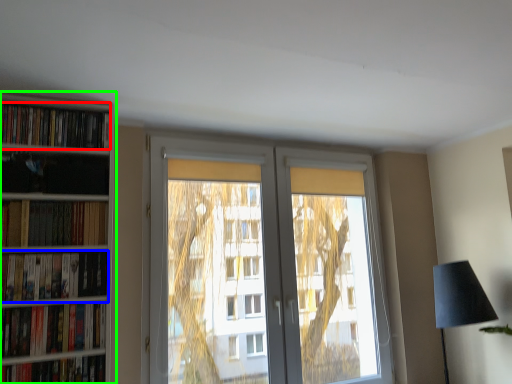
Question: Based on their relative distances, which object is farther from book (highlighted by a red box)? Choose from book (highlighted by a blue box) and bookcase (highlighted by a green box).

Choices:
 (A) book
 (B) bookcase

Answer: (A)